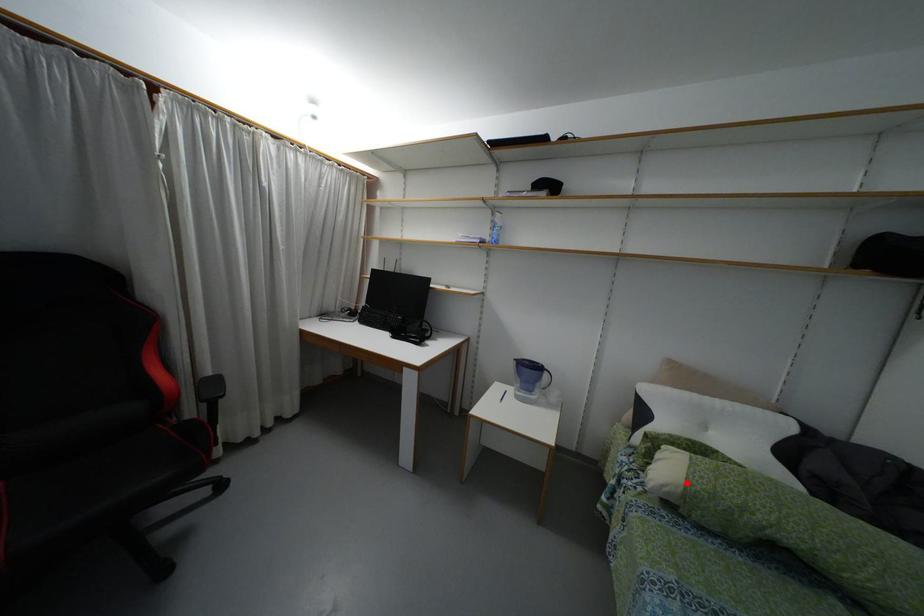
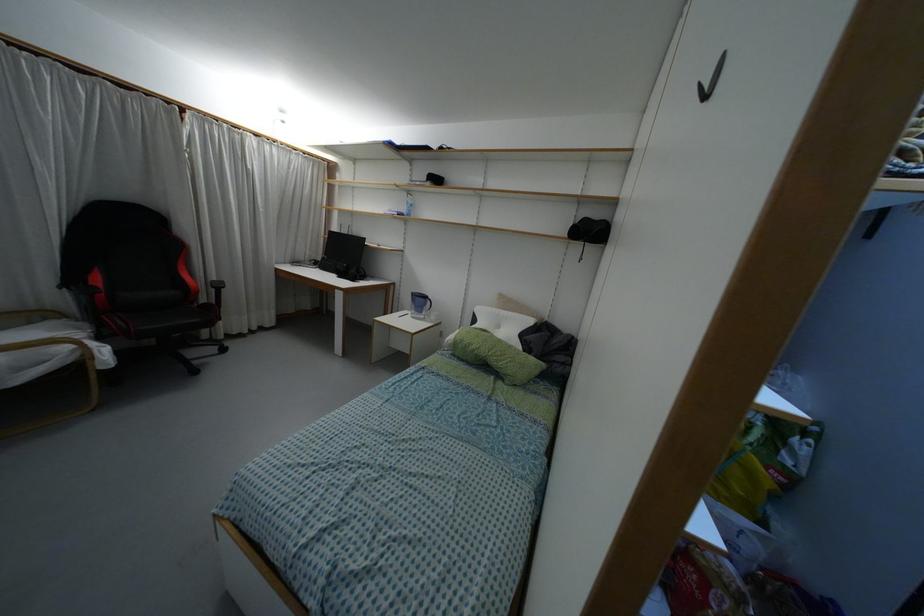
Find the pixel in the second image that matches the highlighted location in the first image.

(455, 337)